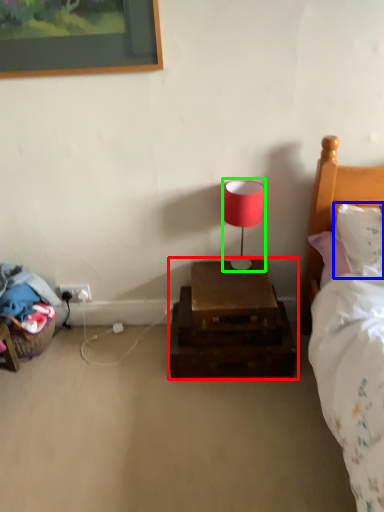
Question: Considering the real-world distances, which object is closest to nightstand (highlighted by a red box)? pillow (highlighted by a blue box) or table lamp (highlighted by a green box).

Choices:
 (A) pillow
 (B) table lamp

Answer: (B)